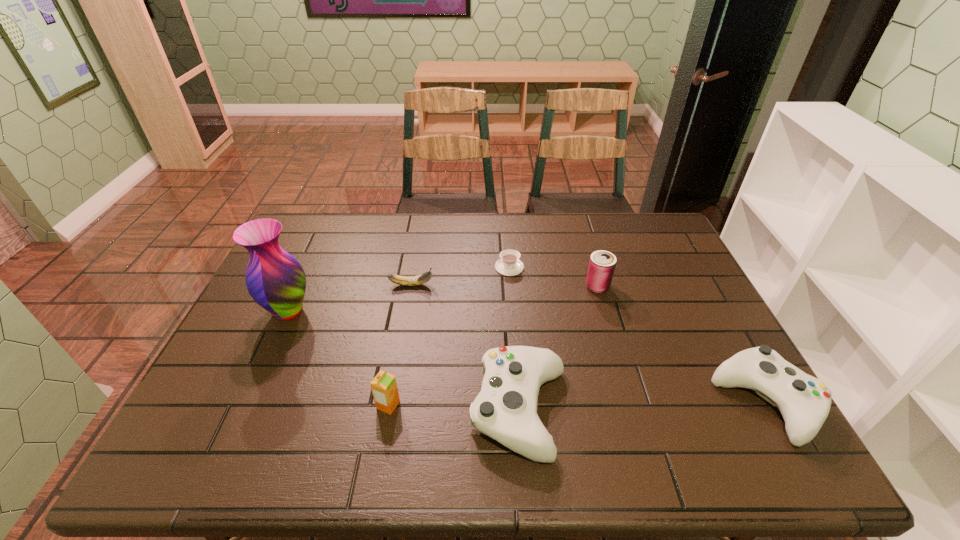
Image resolution: width=960 pixels, height=540 pixels. Find the location of `object at the left edge`. object at the left edge is located at coordinates (274, 278).

The image size is (960, 540). I want to click on object that is at the right edge, so click(x=804, y=401).

Where is `object present at the near right corner`? This screenshot has width=960, height=540. object present at the near right corner is located at coordinates (804, 401).

In the image, there is a desktop. Identify the location of free space at the far edge. (350, 235).

Identify the location of free space at the left edge. (217, 362).

You are a GUI agent. You are given a task and a screenshot of the screen. Output one action in this format:
    pyautogui.click(x=<x>, y=<y>)
    Task: Click on the vacant space at the right edge of the desktop
    
    Given the screenshot: What is the action you would take?
    pyautogui.click(x=674, y=264)

The image size is (960, 540). Identify the location of free space at the far left corner. (312, 231).

Where is `vacant space at the far right corner`? vacant space at the far right corner is located at coordinates (677, 246).

At what (x,y) coordinates should I click in order to perform the action: click on free space between the shorter control and the farthest object. Please return your answer as a coordinate pair (x, y). Looking at the image, I should click on (637, 335).

The image size is (960, 540). In order to click on free space between the banana and the farthest object in this screenshot , I will do `click(460, 276)`.